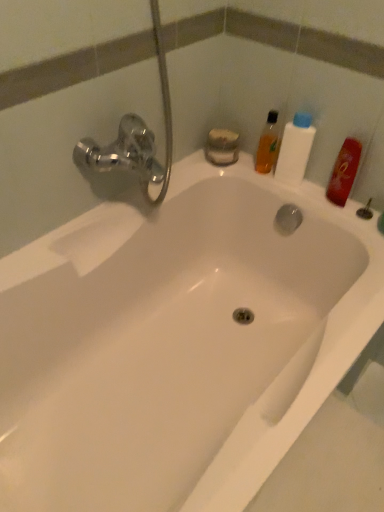
Question: Does translucent orange bottle at upper right, which is counted as the 2th mouthwash, starting from the right, have a larger size compared to white plastic bottle at upper right?

Choices:
 (A) yes
 (B) no

Answer: (B)

Question: Is translucent orange bottle at upper right, which is counted as the 2th mouthwash, starting from the right, with white plastic bottle at upper right?

Choices:
 (A) no
 (B) yes

Answer: (A)

Question: Is translucent orange bottle at upper right, placed as the first mouthwash when sorted from left to right, at the left side of white plastic bottle at upper right?

Choices:
 (A) no
 (B) yes

Answer: (B)

Question: Considering the relative positions of translucent orange bottle at upper right, placed as the first mouthwash when sorted from left to right, and white plastic bottle at upper right in the image provided, is translucent orange bottle at upper right, placed as the first mouthwash when sorted from left to right, to the right of white plastic bottle at upper right from the viewer's perspective?

Choices:
 (A) no
 (B) yes

Answer: (A)

Question: From a real-world perspective, is translucent orange bottle at upper right, which is counted as the 2th mouthwash, starting from the right, on white plastic bottle at upper right?

Choices:
 (A) yes
 (B) no

Answer: (B)

Question: Can you confirm if translucent orange bottle at upper right, placed as the first mouthwash when sorted from left to right, is wider than white plastic bottle at upper right?

Choices:
 (A) no
 (B) yes

Answer: (A)

Question: Is translucent orange bottle at upper right, placed as the first mouthwash when sorted from left to right, facing away from red matte bottle at upper right, arranged as the second mouthwash when viewed from the left?

Choices:
 (A) yes
 (B) no

Answer: (B)

Question: Does translucent orange bottle at upper right, placed as the first mouthwash when sorted from left to right, turn towards red matte bottle at upper right, arranged as the second mouthwash when viewed from the left?

Choices:
 (A) yes
 (B) no

Answer: (B)

Question: Are translucent orange bottle at upper right, which is counted as the 2th mouthwash, starting from the right, and red matte bottle at upper right, which appears as the 1th mouthwash when viewed from the right, located far from each other?

Choices:
 (A) no
 (B) yes

Answer: (A)

Question: Is translucent orange bottle at upper right, placed as the first mouthwash when sorted from left to right, behind red matte bottle at upper right, arranged as the second mouthwash when viewed from the left?

Choices:
 (A) yes
 (B) no

Answer: (A)

Question: Is translucent orange bottle at upper right, placed as the first mouthwash when sorted from left to right, surrounding red matte bottle at upper right, arranged as the second mouthwash when viewed from the left?

Choices:
 (A) no
 (B) yes

Answer: (A)

Question: From the image's perspective, is translucent orange bottle at upper right, which is counted as the 2th mouthwash, starting from the right, above red matte bottle at upper right, arranged as the second mouthwash when viewed from the left?

Choices:
 (A) no
 (B) yes

Answer: (B)

Question: Is translucent orange bottle at upper right, which is counted as the 2th mouthwash, starting from the right, at the back of red matte bottle at upper right, which appears as the 1th mouthwash when viewed from the right?

Choices:
 (A) yes
 (B) no

Answer: (B)